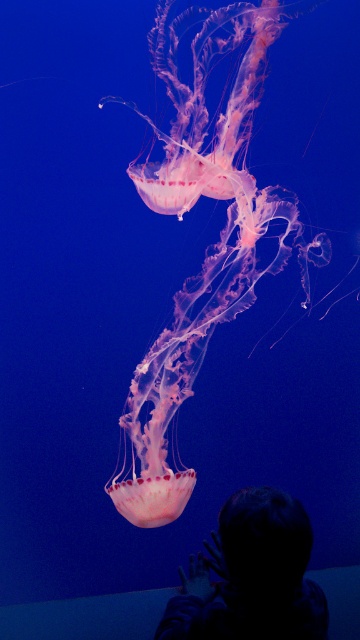
You are a parent trying to take a photo of your child and the jellyfish in the aquarium. The camera you have can only focus on objects within a 15 inch range. Can you capture both the translucent pink jellyfish at center and the silhouette hair at lower center in one focused shot?

The translucent pink jellyfish at center and the silhouette hair at lower center are 18.36 inches apart from each other. Since the camera can only focus within a 15 inch range, the distance between them exceeds the camera limit. Therefore, you cannot capture both in one focused shot.

You are standing in front of an aquarium and see a point marked at coordinates (208, 250). What object is located at that point?

The point at coordinates (208, 250) indicates the translucent pink jellyfish at center.